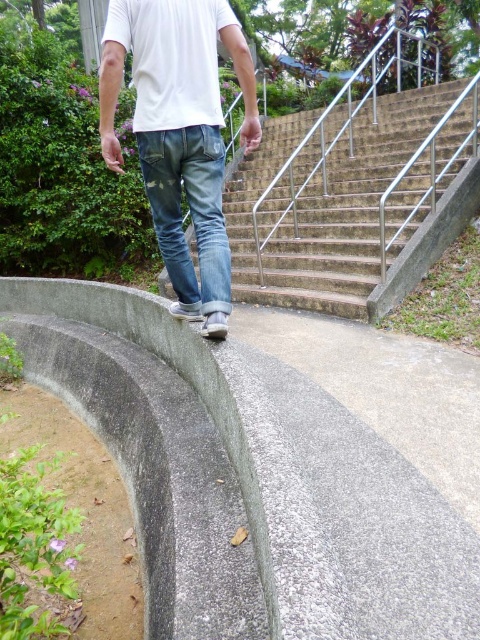
You are standing at the point closer to the stairs in the image. Which point, point (332, 269) or point (189, 284), is farther away from you?

Point (332, 269) is farther away from you because it is behind point (189, 284).